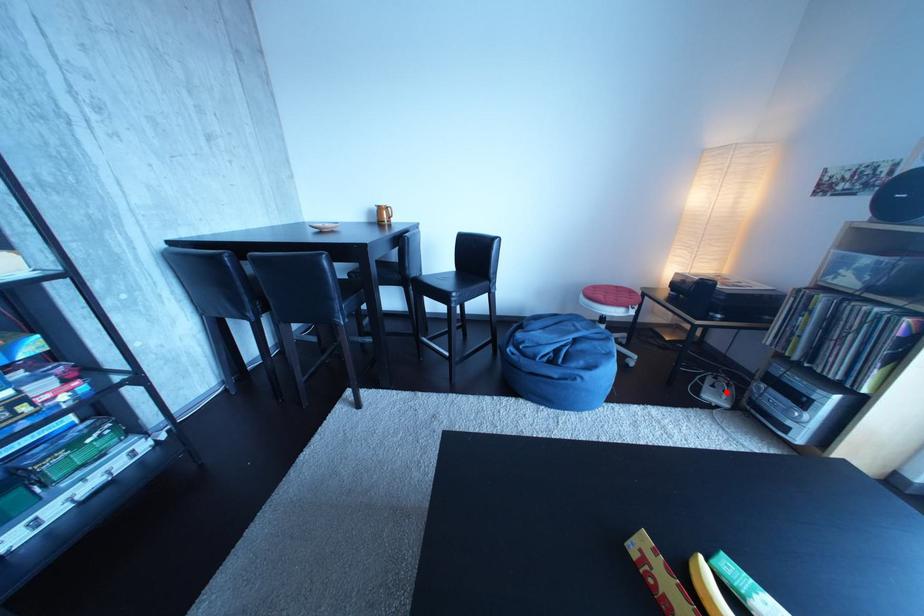
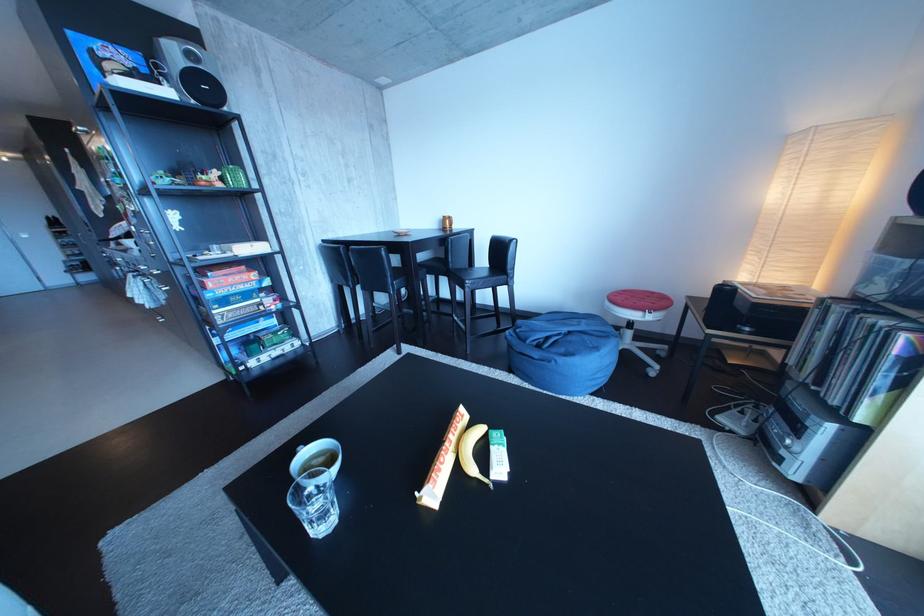
Locate, in the second image, the point that corresponds to the highlighted location in the first image.

(755, 419)